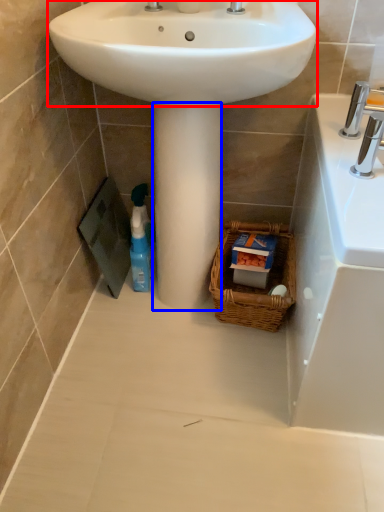
Question: Which object appears farthest to the camera in this image, sink (highlighted by a red box) or pillar (highlighted by a blue box)?

Choices:
 (A) sink
 (B) pillar

Answer: (B)